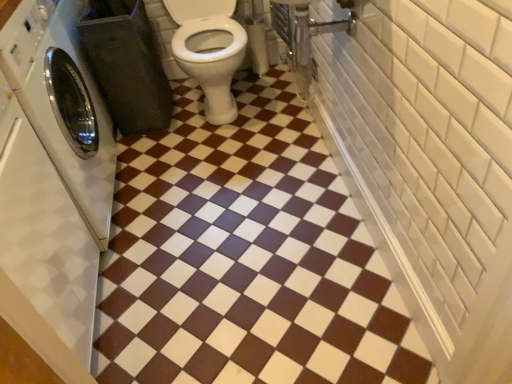
Question: Can you confirm if brown glossy tile at center is shorter than white glossy washing machine at left?

Choices:
 (A) yes
 (B) no

Answer: (A)

Question: Can you confirm if brown glossy tile at center is wider than white glossy washing machine at left?

Choices:
 (A) yes
 (B) no

Answer: (A)

Question: Is brown glossy tile at center taller than white glossy washing machine at left?

Choices:
 (A) yes
 (B) no

Answer: (B)

Question: Is brown glossy tile at center positioned behind white glossy washing machine at left?

Choices:
 (A) no
 (B) yes

Answer: (B)

Question: From a real-world perspective, is brown glossy tile at center physically above white glossy washing machine at left?

Choices:
 (A) no
 (B) yes

Answer: (A)

Question: Is the depth of brown glossy tile at center less than that of white glossy washing machine at left?

Choices:
 (A) no
 (B) yes

Answer: (A)

Question: From a real-world perspective, is white glossy washing machine at left beneath brown glossy tile at center?

Choices:
 (A) no
 (B) yes

Answer: (A)

Question: Does white glossy washing machine at left have a larger size compared to brown glossy tile at center?

Choices:
 (A) yes
 (B) no

Answer: (A)

Question: Is white glossy washing machine at left wider than brown glossy tile at center?

Choices:
 (A) yes
 (B) no

Answer: (B)

Question: Considering the relative sizes of white glossy washing machine at left and brown glossy tile at center in the image provided, is white glossy washing machine at left thinner than brown glossy tile at center?

Choices:
 (A) no
 (B) yes

Answer: (B)

Question: Is white glossy washing machine at left further to camera compared to brown glossy tile at center?

Choices:
 (A) yes
 (B) no

Answer: (B)

Question: Can you confirm if white glossy washing machine at left is shorter than brown glossy tile at center?

Choices:
 (A) no
 (B) yes

Answer: (A)

Question: Does point coord(248,357) appear closer or farther from the camera than point coord(93,167)?

Choices:
 (A) closer
 (B) farther

Answer: (A)